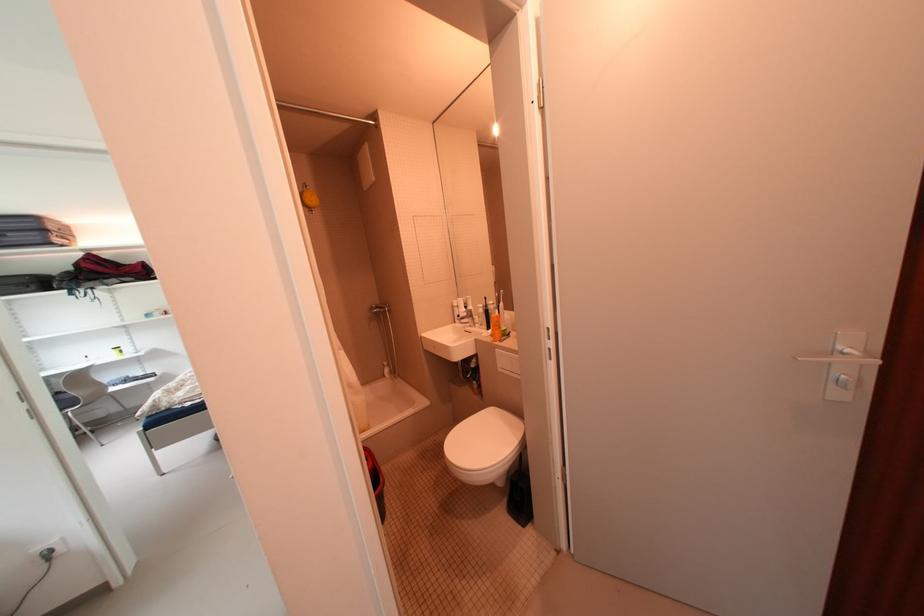
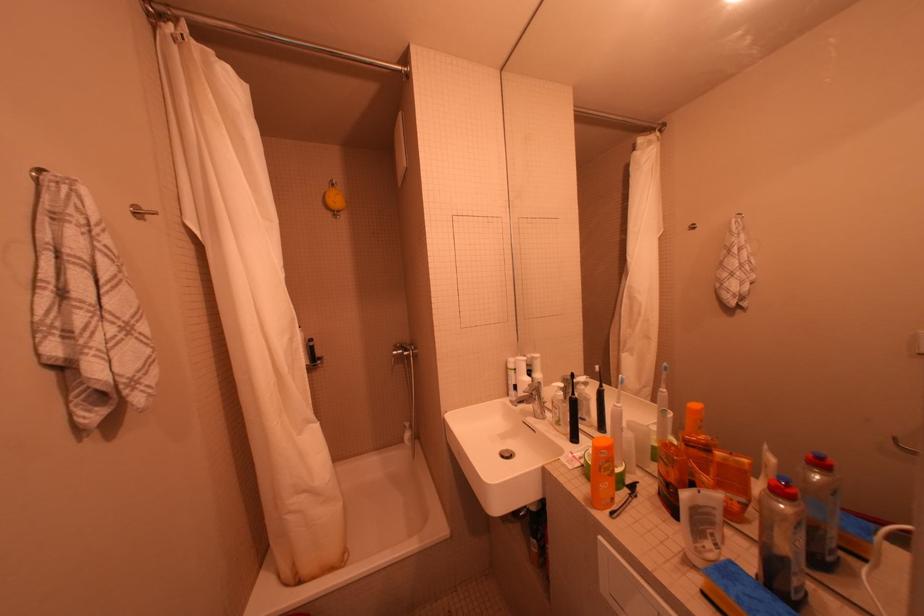
Question: The images are taken continuously from a first-person perspective. In which direction are you moving?

Choices:
 (A) Left
 (B) Right
 (C) Forward
 (D) Backward

Answer: (C)